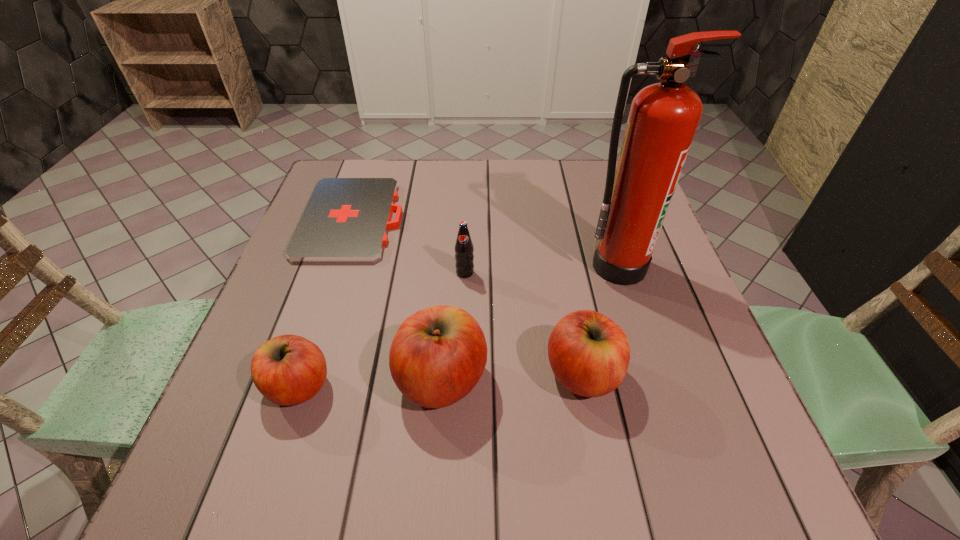
In order to click on free region at the near edge of the desktop in this screenshot , I will do `click(380, 423)`.

Where is `vacant region at the left edge of the desktop`? Image resolution: width=960 pixels, height=540 pixels. vacant region at the left edge of the desktop is located at coordinates click(x=312, y=296).

Where is `vacant space at the right edge of the desktop`? The width and height of the screenshot is (960, 540). vacant space at the right edge of the desktop is located at coordinates (674, 338).

Where is `vacant region at the far left corner of the desktop`? The width and height of the screenshot is (960, 540). vacant region at the far left corner of the desktop is located at coordinates (367, 160).

In the image, there is a desktop. Identify the location of vacant space at the far right corner. This screenshot has width=960, height=540. (600, 206).

I want to click on vacant space at the near right corner of the desktop, so click(x=665, y=406).

Locate an element on the screen. empty location between the second shortest object and the first-aid kit is located at coordinates (325, 303).

Where is `vacant region between the pop and the second shortest object`? The height and width of the screenshot is (540, 960). vacant region between the pop and the second shortest object is located at coordinates (382, 329).

This screenshot has width=960, height=540. I want to click on vacant region between the first-aid kit and the shortest apple, so click(325, 303).

Where is `free space between the pop and the first-aid kit`? This screenshot has width=960, height=540. free space between the pop and the first-aid kit is located at coordinates (409, 246).